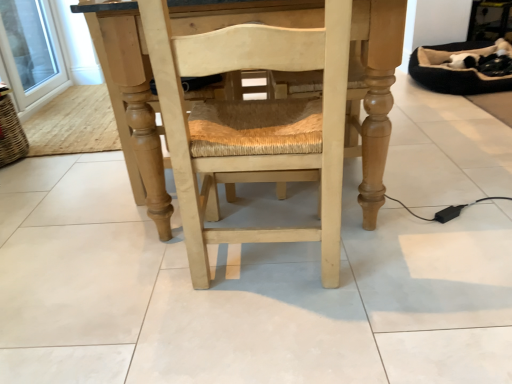
The width and height of the screenshot is (512, 384). Identify the location of vacant region to the left of light wood chair at center. (130, 289).